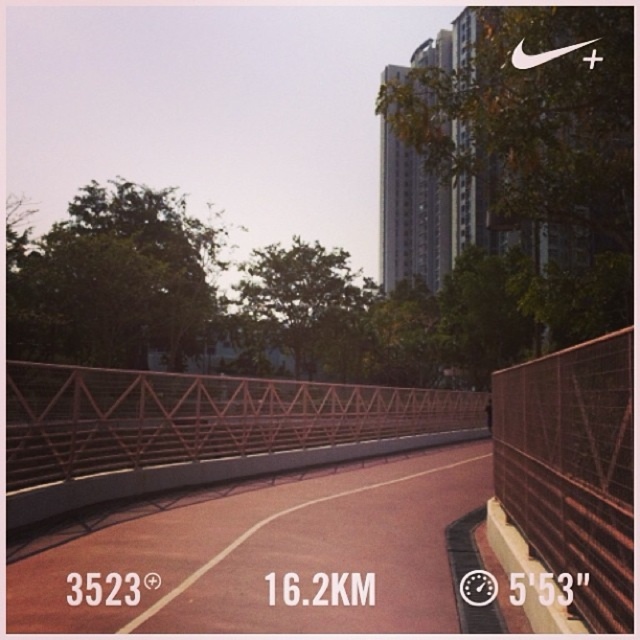
Is metallic pink pedestrian bridge at center bigger than rustic metal fence at right?

Yes, metallic pink pedestrian bridge at center is bigger than rustic metal fence at right.

Where is `metallic pink pedestrian bridge at center`? metallic pink pedestrian bridge at center is located at coordinates (336, 506).